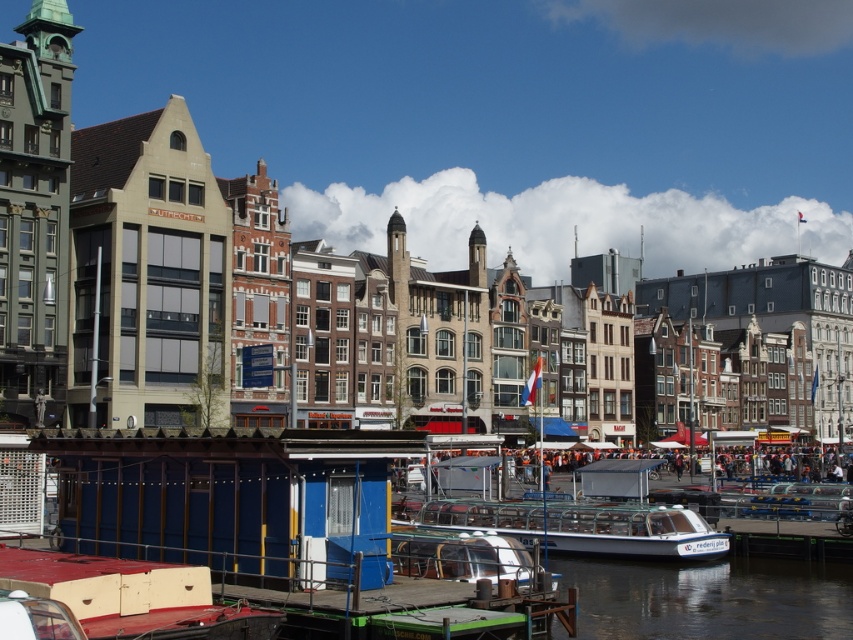
You are a photographer planning to capture a wide shot of the waterfront scene. You need to ensure both the white glossy boat at center and the orange fabric crowd at center fit within your camera frame. Given that your camera has a maximum horizontal field of view of 1.2 meters, can both objects fit side by side without overlapping?

The white glossy boat at center is narrower than the orange fabric crowd at center. However, since the combined width of both objects would exceed the camera frame of 1.2 meters, they cannot fit side by side without overlapping.

You are a photographer trying to capture the white glossy boat at center and the orange fabric crowd at center in a single shot. Based on their positions, which object will appear closer to the camera in the photo?

The white glossy boat at center appears closer to the camera because it is positioned in front of the orange fabric crowd at center.

You are a tour guide leading a group of visitors along the canal. You want to point out both the white glossy boat at center and the orange fabric crowd at center to your group. Which one is closer to the dock area described in the scene?

The white glossy boat at center is closer to the dock area because it is shorter than the orange fabric crowd at center, indicating it is nearer in proximity.